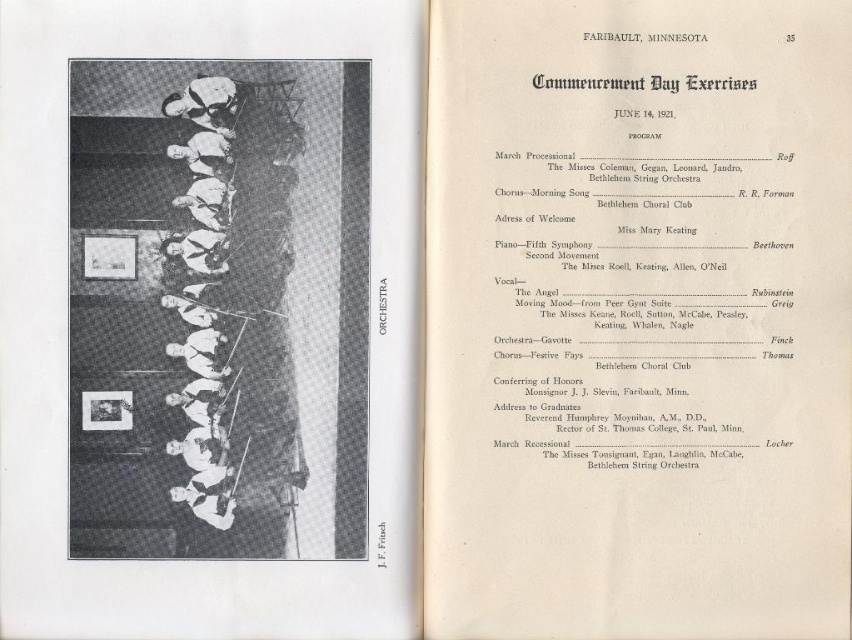
Question: Is white paper menu at upper center to the right of white matte orchestra at center from the viewer's perspective?

Choices:
 (A) no
 (B) yes

Answer: (B)

Question: Among these objects, which one is nearest to the camera?

Choices:
 (A) white matte orchestra at center
 (B) white paper menu at upper center

Answer: (A)

Question: Where is white paper menu at upper center located in relation to white matte orchestra at center in the image?

Choices:
 (A) left
 (B) right

Answer: (B)

Question: Which point appears farthest from the camera in this image?

Choices:
 (A) (842, 186)
 (B) (301, 128)

Answer: (A)

Question: Is white paper menu at upper center below white matte orchestra at center?

Choices:
 (A) yes
 (B) no

Answer: (A)

Question: Which of the following is the closest to the observer?

Choices:
 (A) (521, 237)
 (B) (73, 518)

Answer: (B)